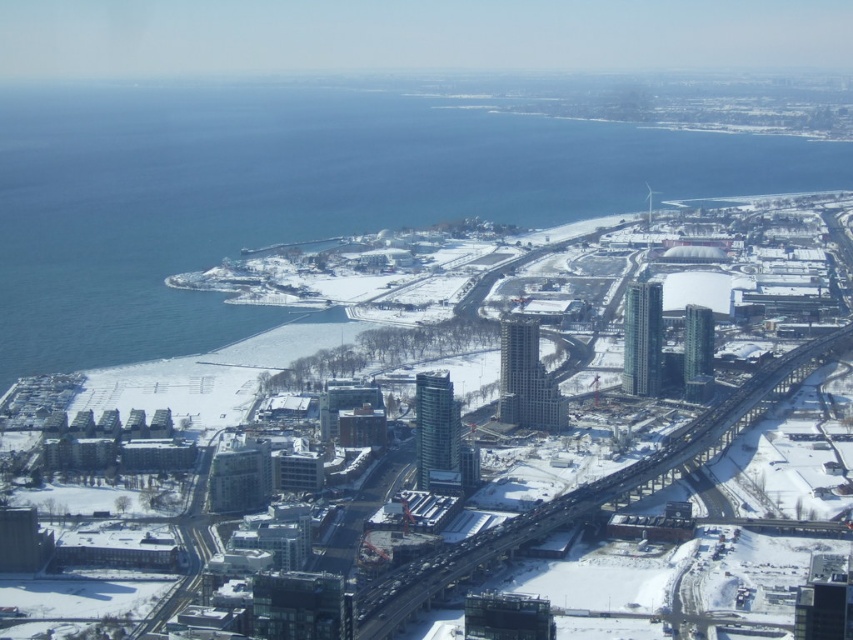
Is point (42, 602) positioned behind point (62, 180)?

That is True.

Which is more to the left, white matte snow at center or blue water at lower left?

From the viewer's perspective, blue water at lower left appears more on the left side.

Between point (846, 440) and point (200, 257), which one is positioned in front?

Point (200, 257) is more forward.

What are the coordinates of `white matte snow at center` in the screenshot? It's located at (404, 422).